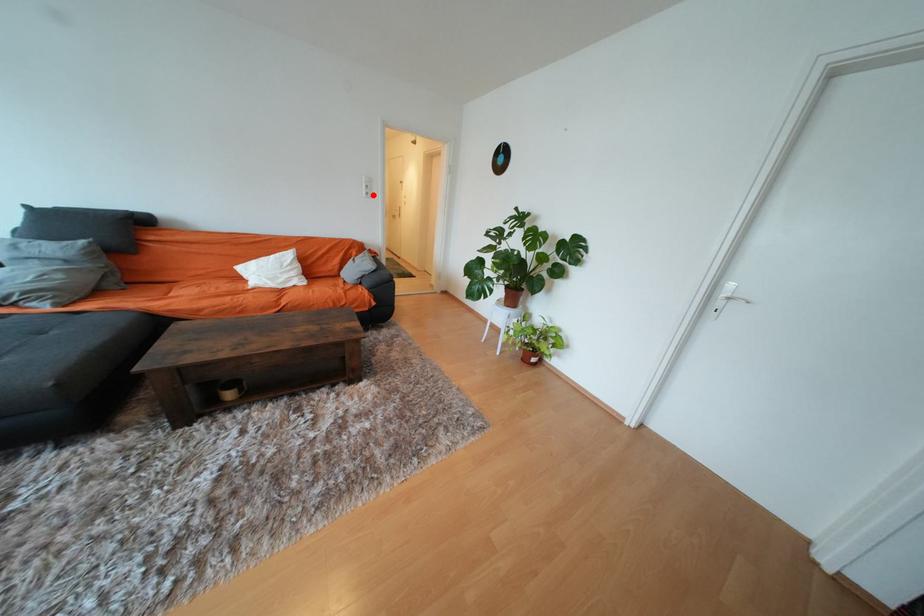
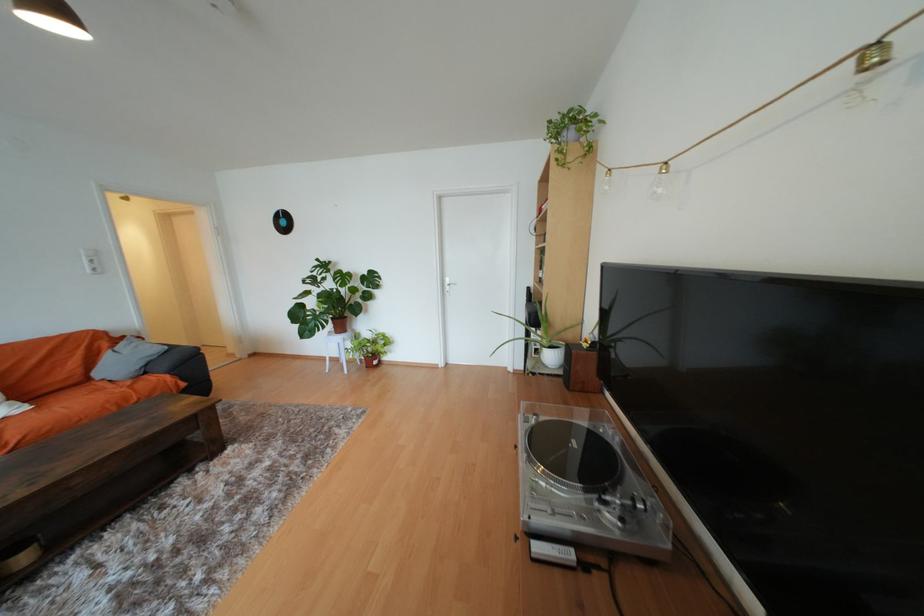
The point at the highlighted location is marked in the first image. Where is the corresponding point in the second image?

(101, 270)